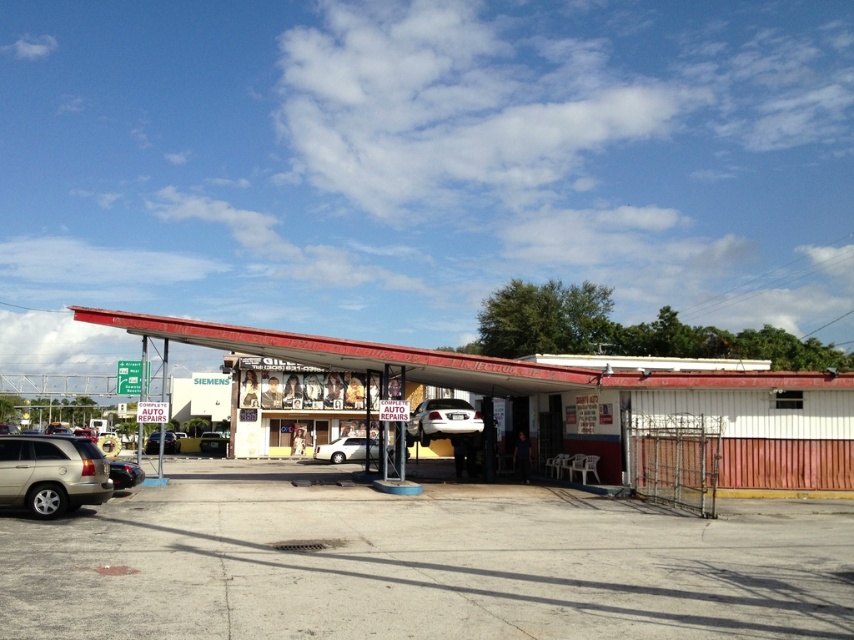
Does point (492, 358) come closer to viewer compared to point (355, 448)?

Yes, point (492, 358) is closer to viewer.

Who is lower down, red corrugated metal awning at center or white matte sedan at center?

white matte sedan at center is lower down.

Who is more distant from viewer, (790, 404) or (349, 436)?

Positioned behind is point (349, 436).

In order to click on red corrugated metal awning at center in this screenshot , I will do `click(594, 401)`.

Is gold metallic suv at lower left to the right of white glossy car at center from the viewer's perspective?

In fact, gold metallic suv at lower left is to the left of white glossy car at center.

Is gold metallic suv at lower left thinner than white glossy car at center?

Yes, gold metallic suv at lower left is thinner than white glossy car at center.

Is point (91, 497) farther from camera compared to point (455, 403)?

No, (91, 497) is in front of (455, 403).

The height and width of the screenshot is (640, 854). I want to click on gold metallic suv at lower left, so click(51, 474).

Can you confirm if white matte sedan at center is smaller than matte black car at center?

Correct, white matte sedan at center occupies less space than matte black car at center.

This screenshot has width=854, height=640. I want to click on white matte sedan at center, so click(342, 449).